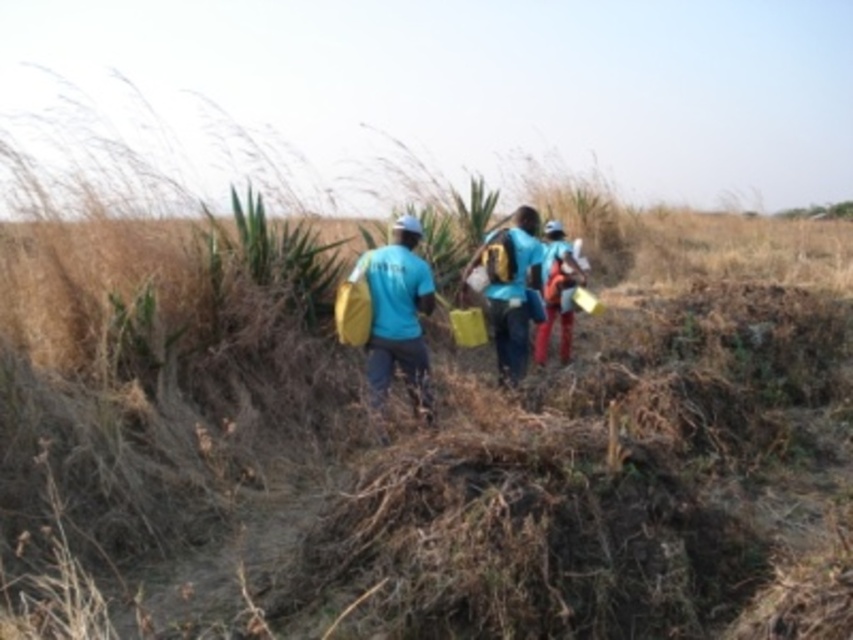
Question: Does blue matte backpack at center have a lesser width compared to matte orange backpack at center?

Choices:
 (A) yes
 (B) no

Answer: (B)

Question: Among these objects, which one is nearest to the camera?

Choices:
 (A) blue matte backpack at center
 (B) matte orange backpack at center
 (C) matte blue shirt at center

Answer: (C)

Question: Which point is closer to the camera?

Choices:
 (A) click(x=403, y=301)
 (B) click(x=538, y=356)
 (C) click(x=524, y=372)

Answer: (A)

Question: Is matte blue shirt at center to the left of blue matte backpack at center from the viewer's perspective?

Choices:
 (A) yes
 (B) no

Answer: (A)

Question: Does matte blue shirt at center appear over matte orange backpack at center?

Choices:
 (A) yes
 (B) no

Answer: (B)

Question: Which point appears farthest from the camera in this image?

Choices:
 (A) (544, 346)
 (B) (410, 227)
 (C) (538, 285)

Answer: (A)